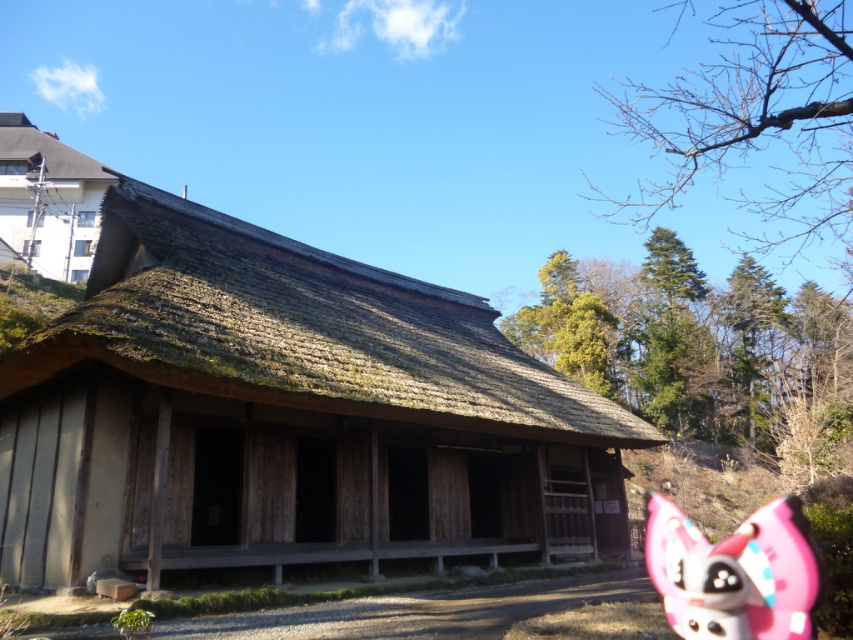
Between pink matte plush toy at lower right and thatched wood hut at upper left, which one appears on the left side from the viewer's perspective?

thatched wood hut at upper left

Can you confirm if pink matte plush toy at lower right is positioned to the right of thatched wood hut at upper left?

Indeed, pink matte plush toy at lower right is positioned on the right side of thatched wood hut at upper left.

The image size is (853, 640). In order to click on pink matte plush toy at lower right in this screenshot , I will do `click(733, 573)`.

I want to click on pink matte plush toy at lower right, so click(x=733, y=573).

Who is positioned more to the right, wooden thatched hut at center or pink matte plush toy at lower right?

pink matte plush toy at lower right

Is wooden thatched hut at center above pink matte plush toy at lower right?

Yes, wooden thatched hut at center is above pink matte plush toy at lower right.

You are a GUI agent. You are given a task and a screenshot of the screen. Output one action in this format:
    pyautogui.click(x=<x>, y=<y>)
    Task: Click on the wooden thatched hut at center
    
    Given the screenshot: What is the action you would take?
    pyautogui.click(x=285, y=416)

Is wooden thatched hut at center closer to the viewer compared to thatched wood hut at upper left?

Yes, it is in front of thatched wood hut at upper left.

Does wooden thatched hut at center have a greater height compared to thatched wood hut at upper left?

No.

Is point (247, 250) positioned after point (96, 179)?

That is False.

Locate an element on the screen. This screenshot has width=853, height=640. wooden thatched hut at center is located at coordinates (285, 416).